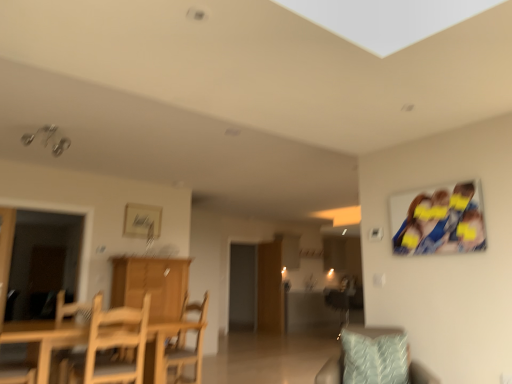
Question: From a real-world perspective, is light blue textured pillow at lower right beneath matte silver picture frame at upper center?

Choices:
 (A) yes
 (B) no

Answer: (A)

Question: Is light blue textured pillow at lower right positioned before matte silver picture frame at upper center?

Choices:
 (A) no
 (B) yes

Answer: (B)

Question: Would you say matte silver picture frame at upper center is part of light blue textured pillow at lower right's contents?

Choices:
 (A) no
 (B) yes

Answer: (A)

Question: Is light blue textured pillow at lower right aimed at matte silver picture frame at upper center?

Choices:
 (A) yes
 (B) no

Answer: (B)

Question: Is light blue textured pillow at lower right positioned with its back to matte silver picture frame at upper center?

Choices:
 (A) yes
 (B) no

Answer: (B)

Question: From a real-world perspective, relative to wooden cabinet at center, is transparent glass door at left, the 2th glass door in the back-to-front sequence, vertically above or below?

Choices:
 (A) below
 (B) above

Answer: (B)

Question: Looking at their shapes, would you say transparent glass door at left, the first glass door in the left-to-right sequence, is wider or thinner than wooden cabinet at center?

Choices:
 (A) wide
 (B) thin

Answer: (B)

Question: In the image, is transparent glass door at left, the 1th glass door viewed from the front, on the left side or the right side of wooden cabinet at center?

Choices:
 (A) right
 (B) left

Answer: (B)

Question: From the image's perspective, is transparent glass door at left, which ranks as the second glass door in right-to-left order, above or below wooden cabinet at center?

Choices:
 (A) above
 (B) below

Answer: (A)

Question: Considering their positions, is blue fabric photo at upper right located in front of or behind matte silver picture frame at upper center?

Choices:
 (A) behind
 (B) front

Answer: (B)

Question: Does point (442, 198) appear closer or farther from the camera than point (142, 226)?

Choices:
 (A) farther
 (B) closer

Answer: (B)

Question: Is blue fabric photo at upper right bigger or smaller than matte silver picture frame at upper center?

Choices:
 (A) big
 (B) small

Answer: (A)

Question: Is blue fabric photo at upper right taller or shorter than matte silver picture frame at upper center?

Choices:
 (A) tall
 (B) short

Answer: (A)

Question: Is wooden chair at lower left taller or shorter than light wood table at lower left?

Choices:
 (A) tall
 (B) short

Answer: (A)

Question: In the image, is wooden chair at lower left on the left side or the right side of light wood table at lower left?

Choices:
 (A) left
 (B) right

Answer: (A)